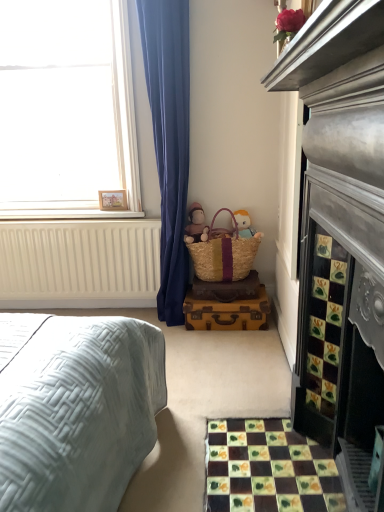
I want to click on vacant area on top of white painted wood at upper left (from a real-world perspective), so click(62, 211).